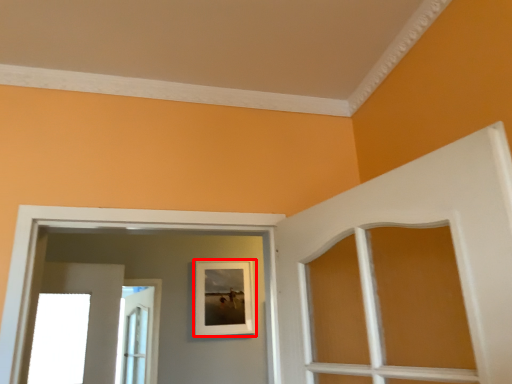
Question: Observing the image, what is the correct spatial positioning of picture frame (annotated by the red box) in reference to door?

Choices:
 (A) left
 (B) right

Answer: (B)